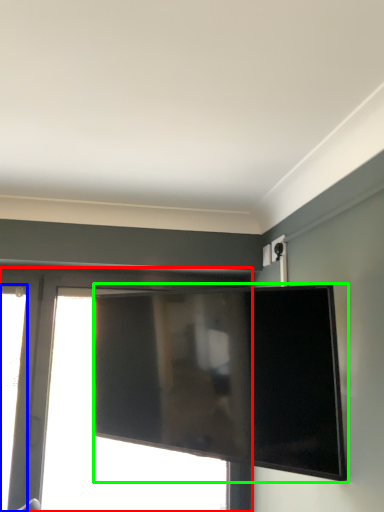
Question: Estimate the real-world distances between objects in this image. Which object is farther from window (highlighted by a red box), window (highlighted by a blue box) or television (highlighted by a green box)?

Choices:
 (A) window
 (B) television

Answer: (B)